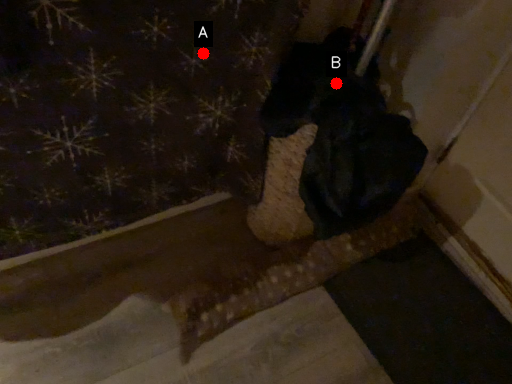
Question: Two points are circled on the image, labeled by A and B beside each circle. Which point is farther from the camera taking this photo?

Choices:
 (A) A is further
 (B) B is further

Answer: (B)